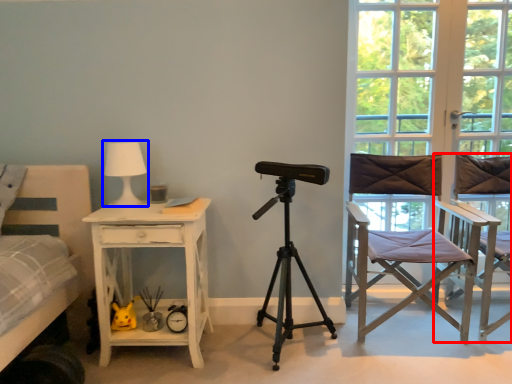
Question: Which object appears closest to the camera in this image, chair (highlighted by a red box) or table lamp (highlighted by a blue box)?

Choices:
 (A) chair
 (B) table lamp

Answer: (A)